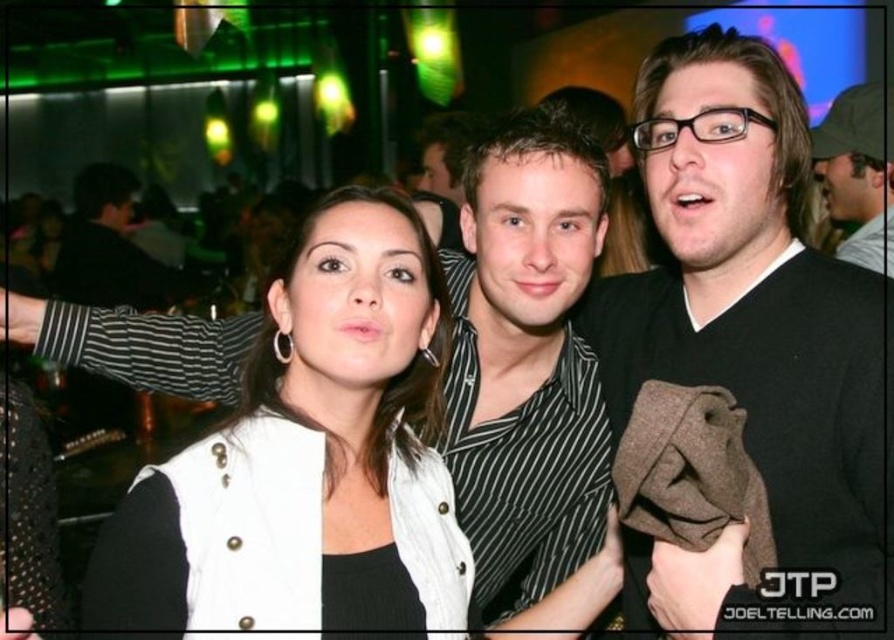
You are a photographer adjusting your camera settings to focus on the black matte shirt at center and the white textured vest at center. Which one should you focus on first to ensure both are in sharp focus?

The black matte shirt at center is further to the viewer than the white textured vest at center, so you should focus on the black matte shirt at center first to ensure both are in sharp focus.

You are standing at the point closest to the camera in the image. Which of the two points, point (394, 365) or point (95, 236), are you currently at?

You are at point (394, 365) because it is in front of point (95, 236), making it closer to the camera.

In the nightclub scene, you see the white textured vest at center and the black striped shirt at left. Which clothing item is positioned more to the right?

The white textured vest at center is positioned more to the right than the black striped shirt at left.